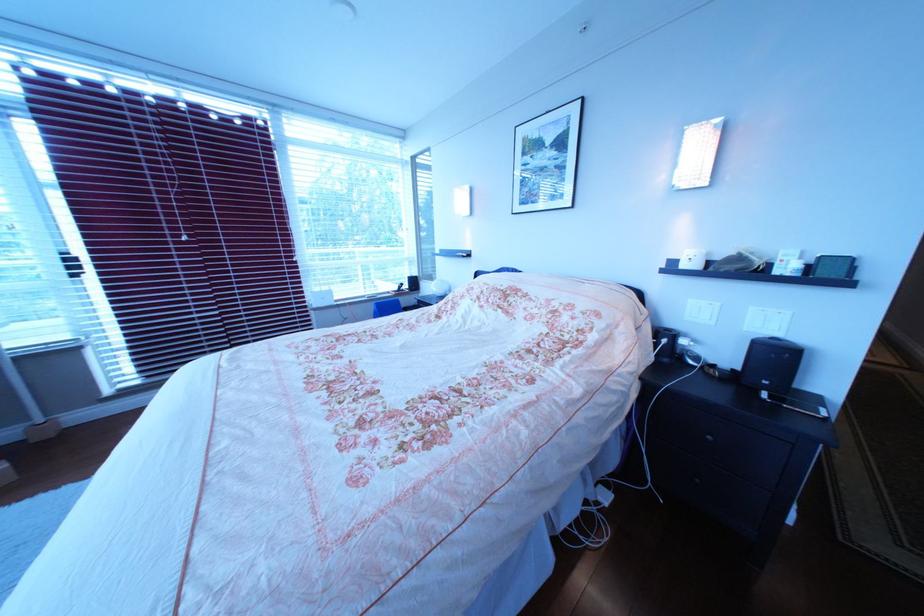
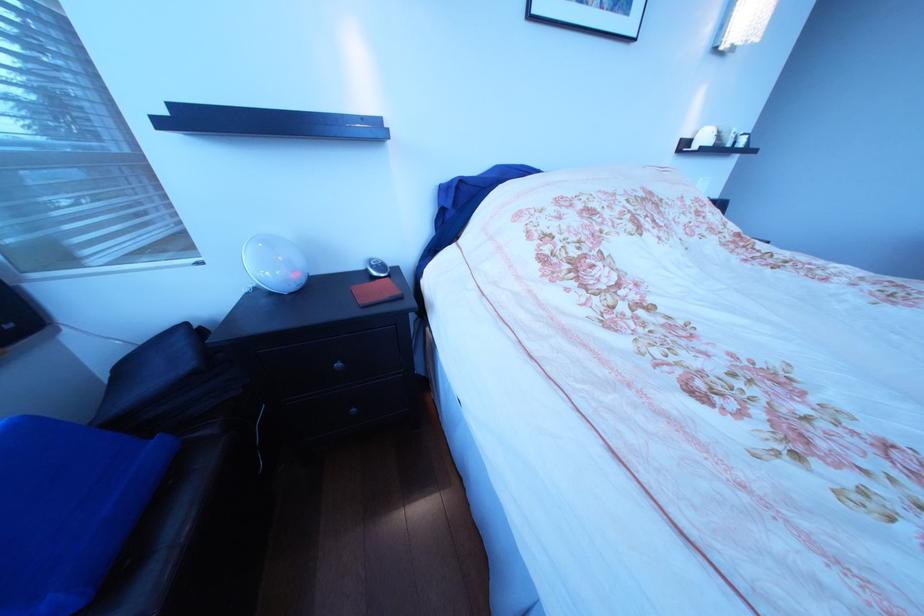
Locate, in the second image, the point that corresponds to [713,268] in the first image.

(724, 146)